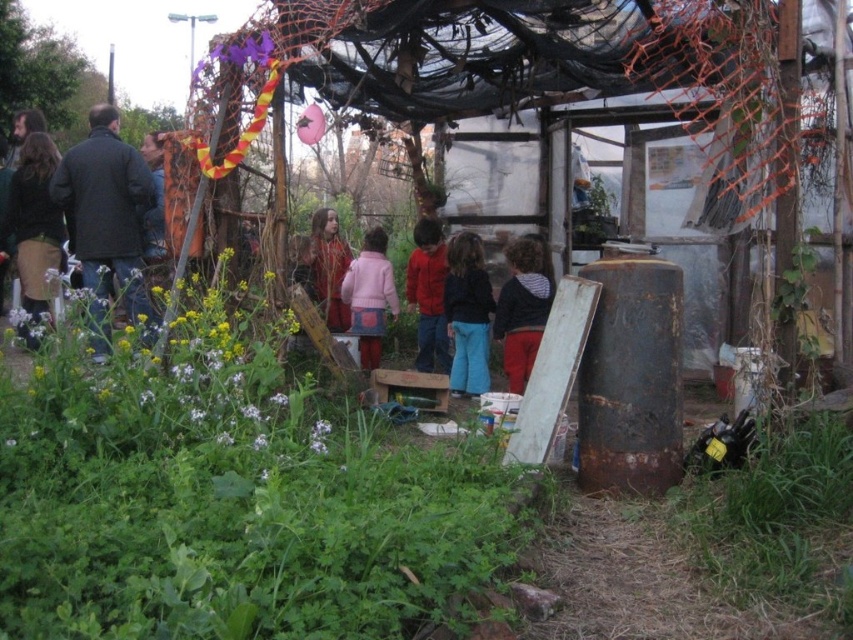
Question: Does brown corduroy pants at left lie in front of brown textured coat at center?

Choices:
 (A) no
 (B) yes

Answer: (B)

Question: Which of the following is the farthest from the observer?

Choices:
 (A) (144, 180)
 (B) (7, 224)

Answer: (B)

Question: Can you confirm if dark blue jacket at left is bigger than pink matte jacket at center?

Choices:
 (A) yes
 (B) no

Answer: (A)

Question: Estimate the real-world distances between objects in this image. Which object is closer to the green leafy plant at lower left?

Choices:
 (A) pink matte jacket at center
 (B) brown corduroy pants at left

Answer: (A)

Question: Which point is farther to the camera?

Choices:
 (A) green leafy plants at center
 (B) dark blue jacket at left
 (C) blue denim pants at center
 (D) brown textured coat at center

Answer: (D)

Question: In this image, where is pink matte jacket at center located relative to brown textured coat at center?

Choices:
 (A) left
 (B) right

Answer: (B)